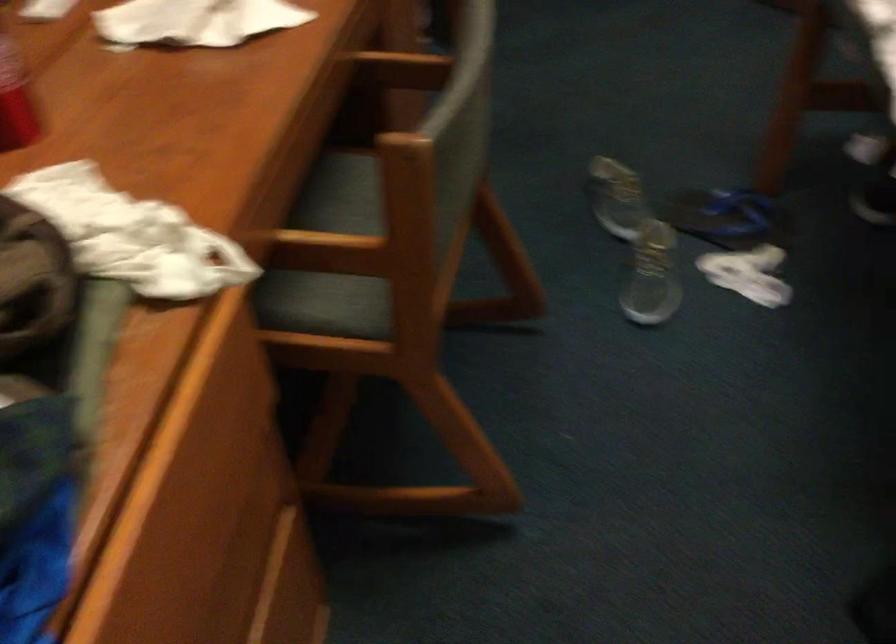
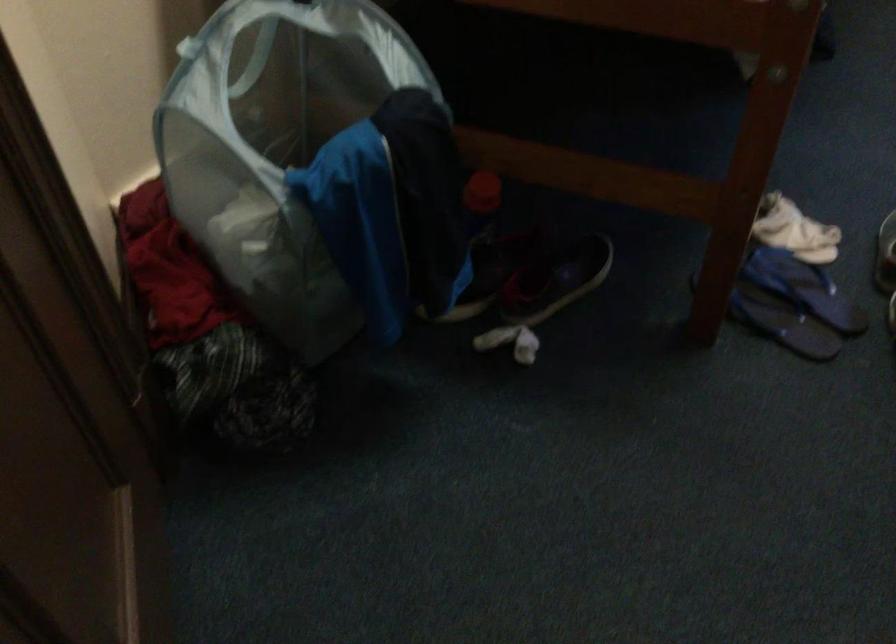
Find the pixel in the second image that matches point 711,228 in the first image.

(804, 288)